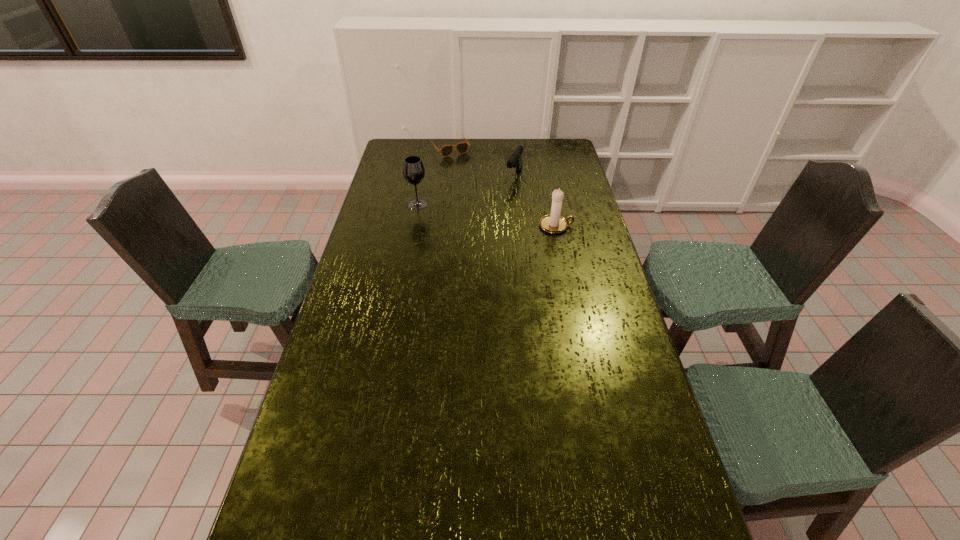
You are a GUI agent. You are given a task and a screenshot of the screen. Output one action in this format:
    pyautogui.click(x=<x>, y=<y>)
    Task: Click on the vacant space that's between the pistol and the wineglass
    Image resolution: width=960 pixels, height=540 pixels.
    Given the screenshot: What is the action you would take?
    pyautogui.click(x=466, y=190)

Identify the location of empty space that is in between the second farthest object and the wineglass. The height and width of the screenshot is (540, 960). (466, 190).

Find the location of a particular element. The height and width of the screenshot is (540, 960). object that is the closest one to the sunglasses is located at coordinates (515, 161).

Find the location of a particular element. The width and height of the screenshot is (960, 540). object that is the third closest to the second tallest object is located at coordinates (462, 147).

Where is `free location that satisfies the following two spatial constraints: 1. on the front side of the candle holder; 2. on the handle side of the pistol`? free location that satisfies the following two spatial constraints: 1. on the front side of the candle holder; 2. on the handle side of the pistol is located at coordinates (520, 226).

What are the coordinates of `vacant region that satisfies the following two spatial constraints: 1. on the front side of the third shortest object; 2. on the handle side of the third object from left to right` in the screenshot? It's located at (520, 226).